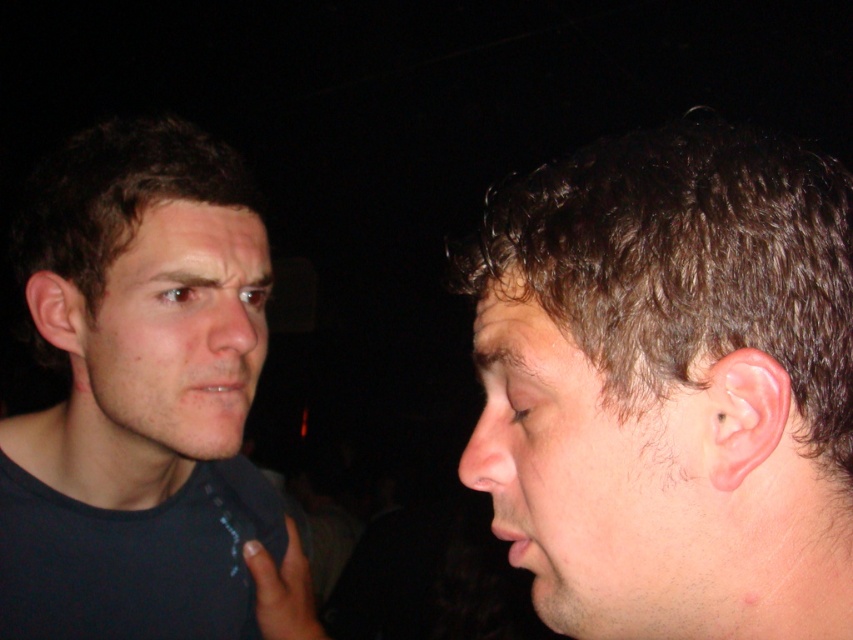
Question: Which of the following is the farthest from the observer?

Choices:
 (A) (120, 536)
 (B) (698, 204)
 (C) (265, 275)

Answer: (A)

Question: Among these objects, which one is farthest from the camera?

Choices:
 (A) dark blue shirt at left
 (B) pale skin at right
 (C) pale skin face at left
 (D) dark brown hair at right

Answer: (C)

Question: Is dark brown hair at right below pale skin face at left?

Choices:
 (A) no
 (B) yes

Answer: (A)

Question: Is dark blue shirt at left positioned in front of pale skin face at left?

Choices:
 (A) yes
 (B) no

Answer: (A)

Question: Considering the real-world distances, which object is farthest from the dark blue shirt at left?

Choices:
 (A) dark brown hair at right
 (B) pale skin at right

Answer: (B)

Question: Observing the image, what is the correct spatial positioning of dark blue shirt at left in reference to pale skin face at left?

Choices:
 (A) below
 (B) above

Answer: (A)